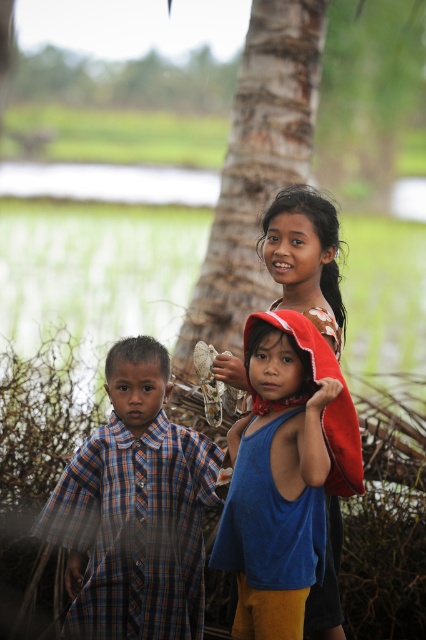
In the scene shown: You are a photographer trying to capture a clear shot of the brown rough tree trunk at center without the plaid fabric shirt at left blocking it. What should you do?

The plaid fabric shirt at left is in front of the brown rough tree trunk at center, so you should move your camera position to the right to position the tree trunk away from the obstruction.

You are a photographer trying to capture a photo of the plaid fabric shirt at left and the brown rough tree trunk at center. Based on their heights, which object should you focus on first if you want to ensure both are in frame without adjusting your camera angle?

The plaid fabric shirt at left is not as tall as the brown rough tree trunk at center, so you should focus on the brown rough tree trunk at center first to ensure both are in frame.